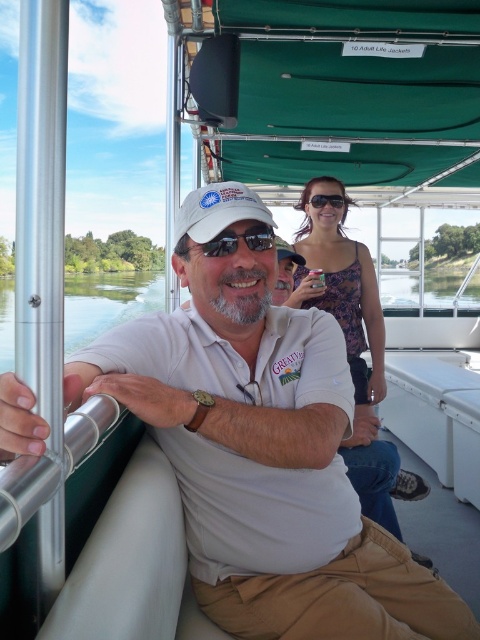
Is point (396, 483) in front of point (310, 198)?

Yes, it is in front of point (310, 198).

Does point (292, 296) lie in front of point (342, 205)?

Yes, point (292, 296) is in front of point (342, 205).

Locate an element on the screen. This screenshot has height=640, width=480. floral fabric dress at center is located at coordinates (351, 340).

Which is above, sunglasses at center or matte black sunglasses at upper center?

matte black sunglasses at upper center is higher up.

Is sunglasses at center positioned in front of matte black sunglasses at upper center?

That is True.

Identify the location of sunglasses at center. (238, 241).

Is floral fabric dress at center further to the viewer compared to sunglasses at center?

Yes, it is behind sunglasses at center.

Describe the element at coordinates (351, 340) in the screenshot. I see `floral fabric dress at center` at that location.

Does point (372, 392) come closer to viewer compared to point (184, 248)?

No, it is behind (184, 248).

Locate an element on the screen. Image resolution: width=480 pixels, height=640 pixels. floral fabric dress at center is located at coordinates (351, 340).